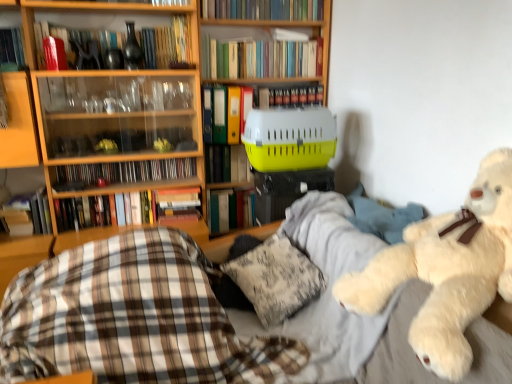
The height and width of the screenshot is (384, 512). What are the coordinates of `free location above hardcover book at center, arranged as the second book when ordered from the bottom (from a real-world perspective)` in the screenshot? It's located at coord(231,185).